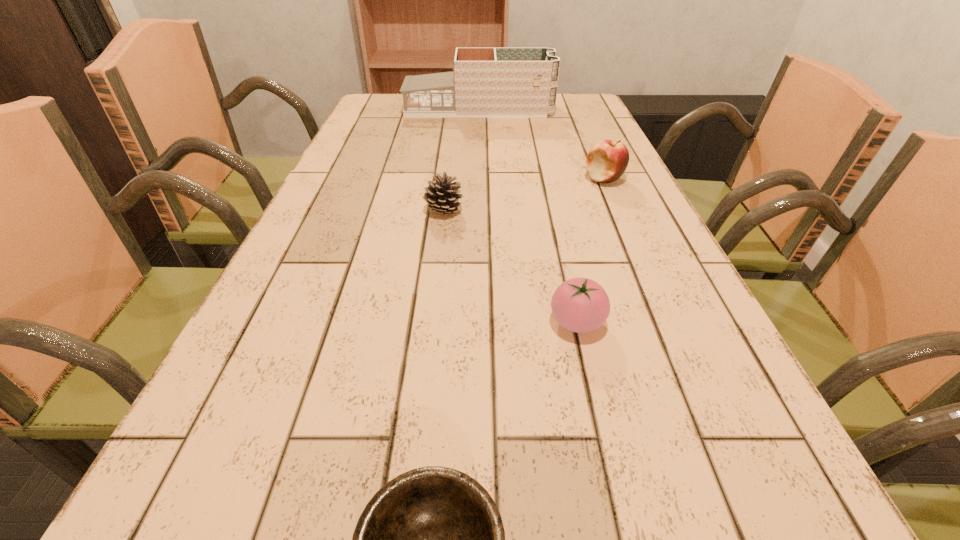
This screenshot has height=540, width=960. In order to click on free space that satisfies the following two spatial constraints: 1. at the entrance of the tallest object; 2. on the left side of the second farthest object in this screenshot , I will do `click(478, 179)`.

At what (x,y) coordinates should I click in order to perform the action: click on free region that satisfies the following two spatial constraints: 1. at the entrance of the farthest object; 2. on the back side of the rightmost object. Please return your answer as a coordinate pair (x, y). The image size is (960, 540). Looking at the image, I should click on (478, 179).

Locate an element on the screen. blank area in the image that satisfies the following two spatial constraints: 1. at the entrance of the farthest object; 2. on the right side of the tomato is located at coordinates [478, 322].

Locate an element on the screen. This screenshot has width=960, height=540. free space that satisfies the following two spatial constraints: 1. at the entrance of the tallest object; 2. on the left side of the fourth farthest object is located at coordinates point(478,322).